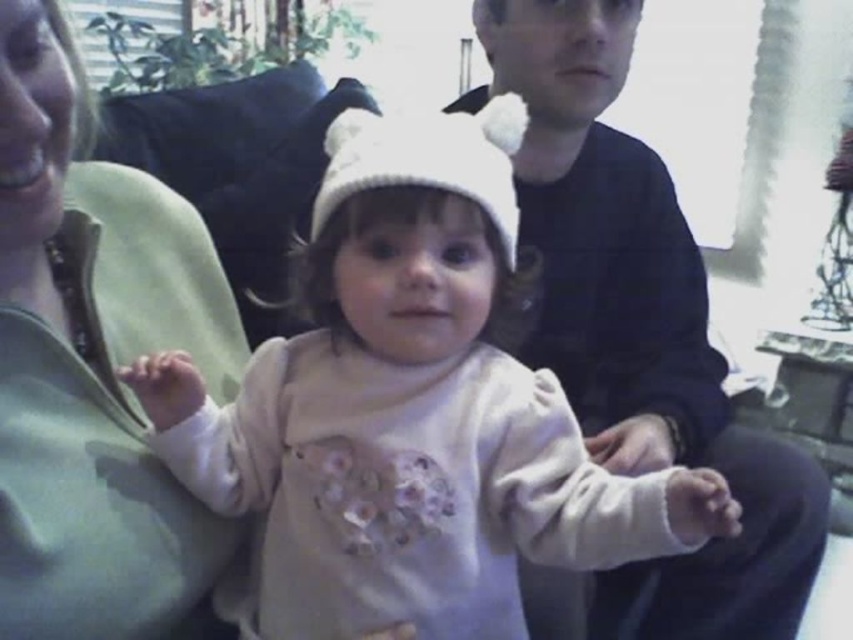
You are arranging a photo shoot and need to ensure that the matte green pillow at left and the dark blue sweater at center are both visible in the frame. Based on their sizes, which object should you prioritize positioning first to ensure both fit comfortably?

The matte green pillow at left is smaller than the dark blue sweater at center, so you should prioritize positioning the dark blue sweater at center first to ensure both fit comfortably.